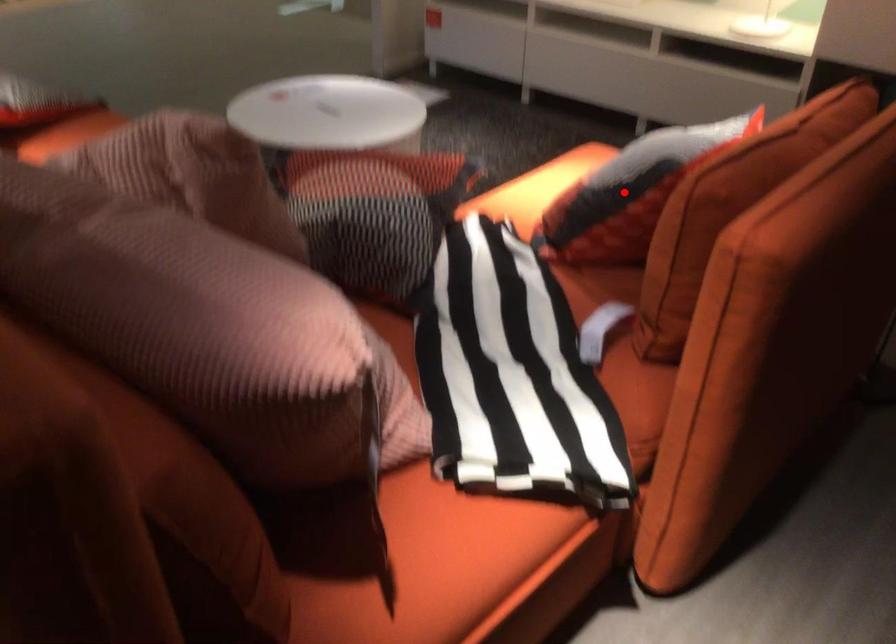
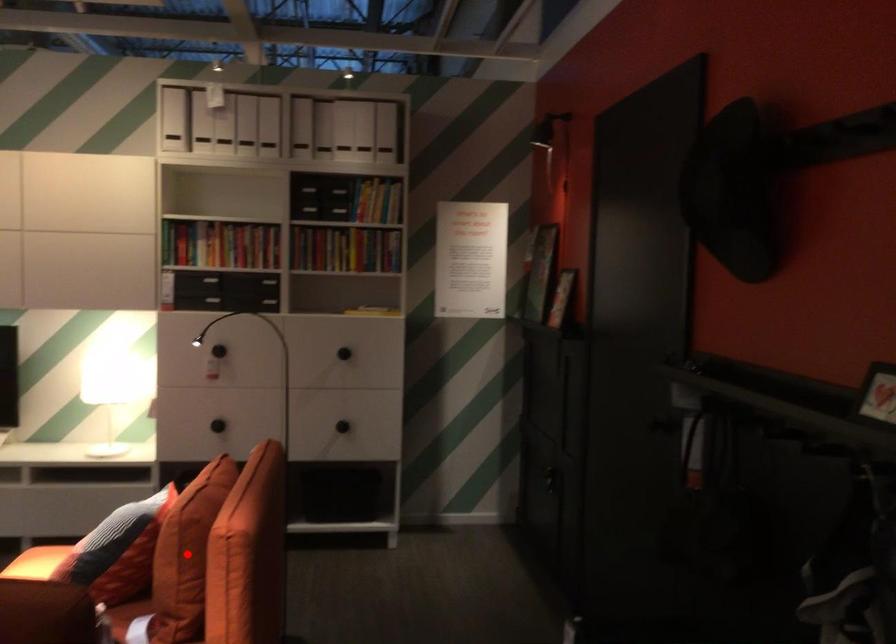
I am providing you with two images of the same scene from different viewpoints. A red point is marked on the first image and another point is marked on the second image. Do the highlighted points in image1 and image2 indicate the same real-world spot?

No